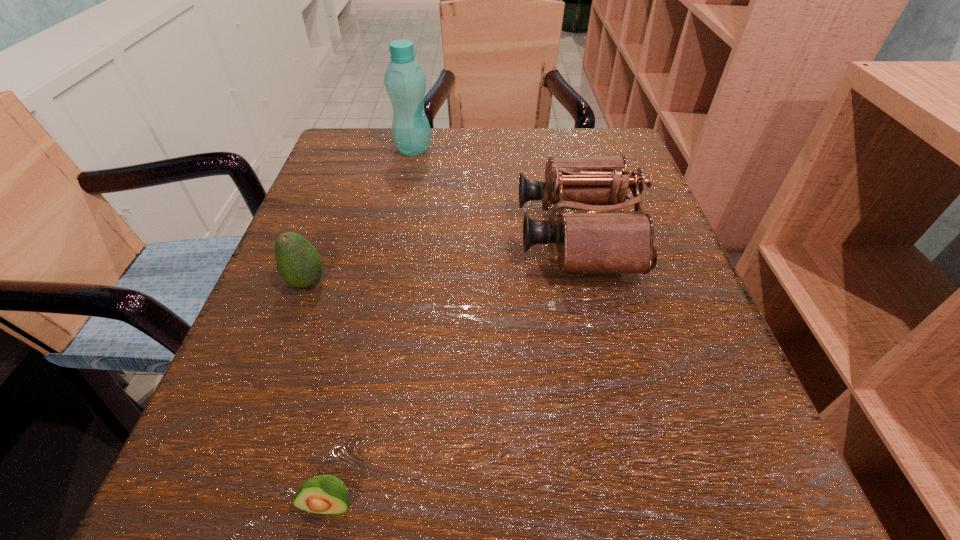
The height and width of the screenshot is (540, 960). I want to click on vacant position in the image that satisfies the following two spatial constraints: 1. through the eyepieces of the rightmost object; 2. on the cut side of the shorter avocado, so (x=639, y=504).